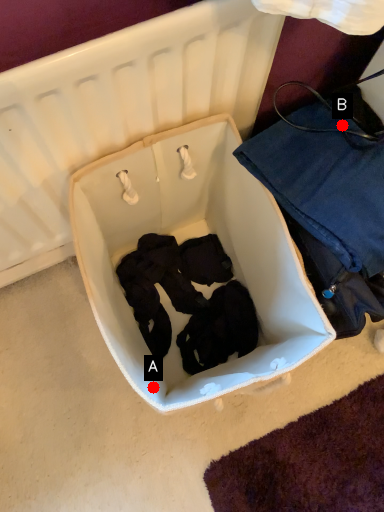
Question: Two points are circled on the image, labeled by A and B beside each circle. Which point appears farthest from the camera in this image?

Choices:
 (A) A is further
 (B) B is further

Answer: (B)